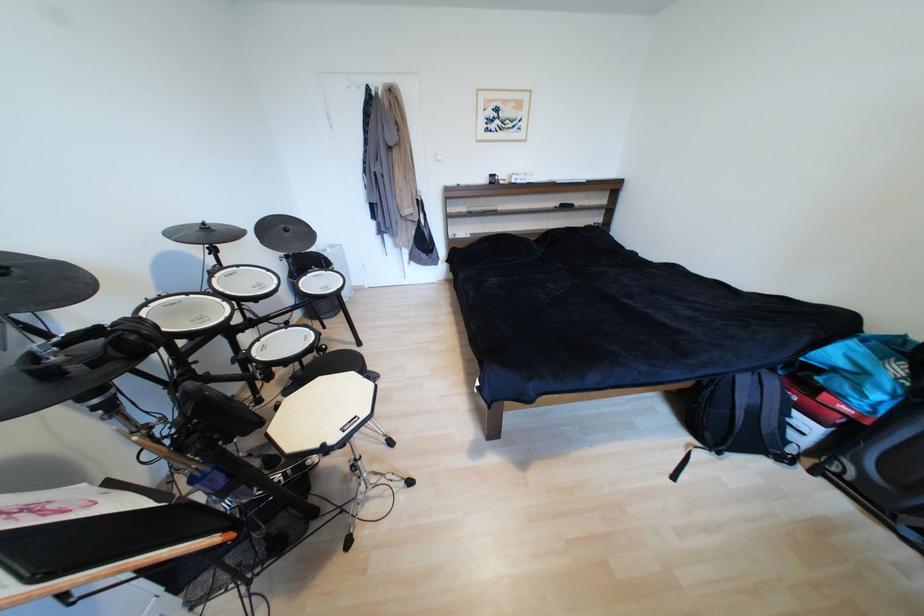
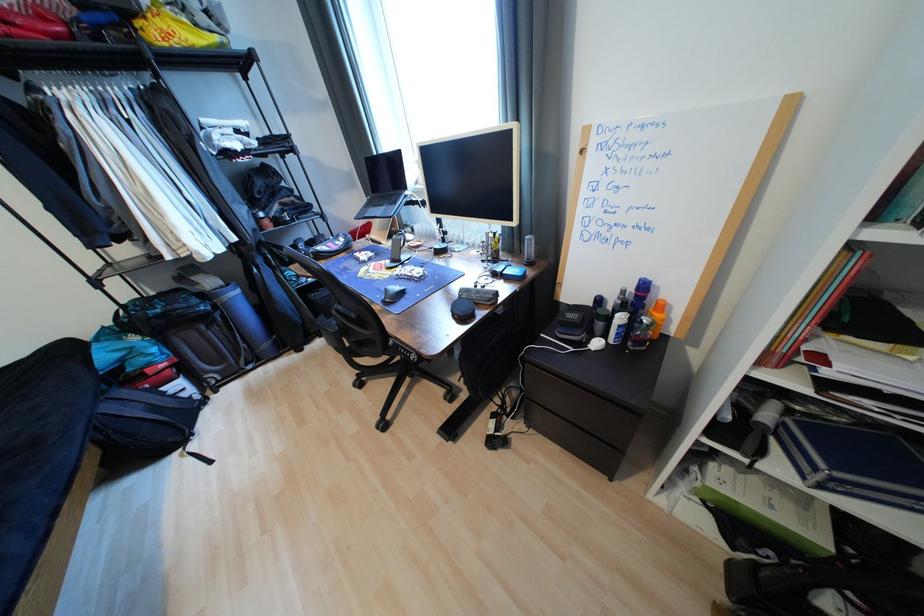
Find the pixel in the second image that matches the point at 751,381 in the first image.

(116, 408)